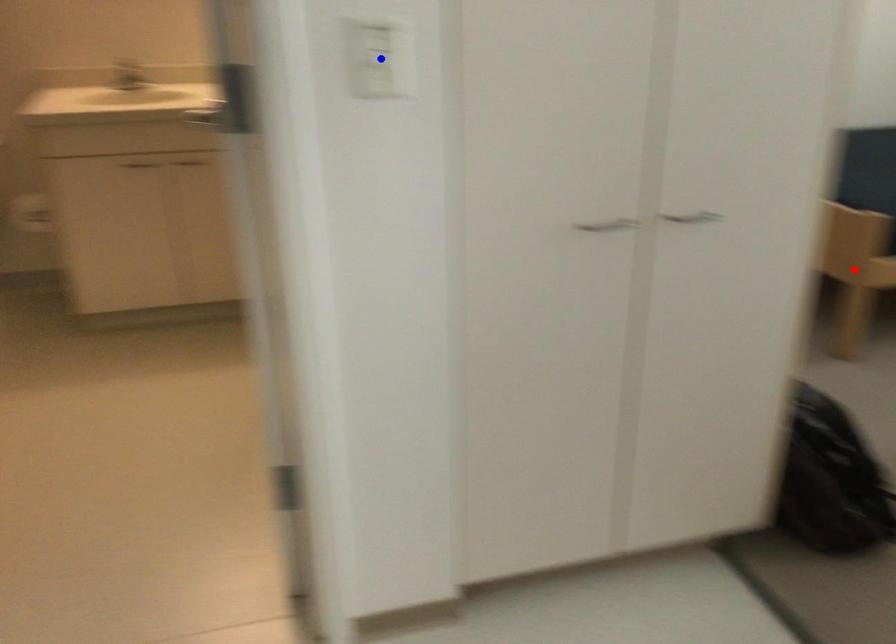
Question: Which of the two points in the image is closer to the camera?

Choices:
 (A) Blue point is closer.
 (B) Red point is closer.

Answer: (A)